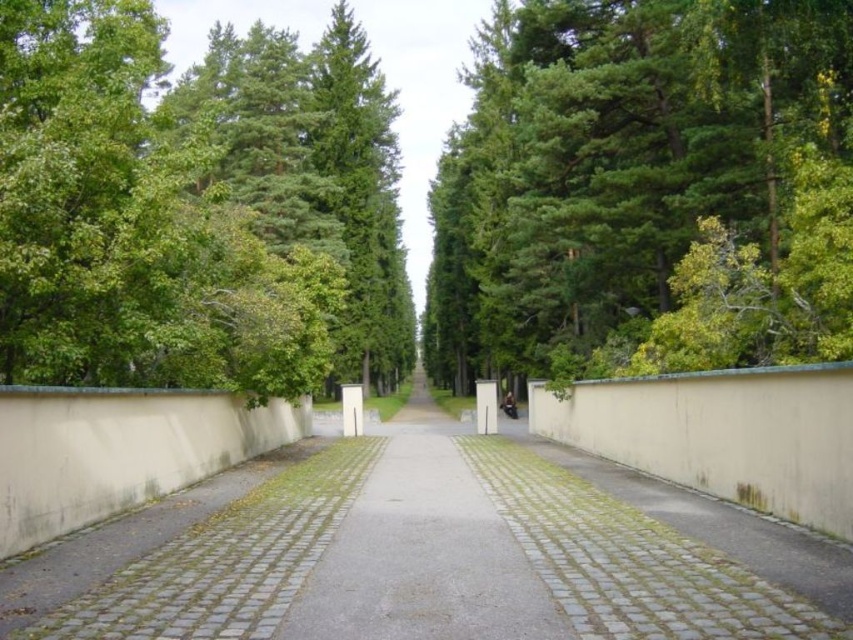
You are a gardener standing on the pathway in the image. You need to place a new decorative stone. The stone is too heavy to lift, so you must decide whether to place it on the beige concrete pavement at center or the gray cobblestone pavement at center based on their positions. Which pavement is higher and thus more accessible for placing the stone without moving it?

The beige concrete pavement at center is located above the gray cobblestone pavement at center, so the beige concrete pavement at center is higher and more accessible for placing the stone without moving it.

You are standing at the entrance of the pathway and want to walk towards the green leafy tree at center. Which direction should you walk to avoid the larger green leafy tree at left?

The green leafy tree at center is smaller than the green leafy tree at left. To avoid the larger tree on the left, walk towards the right side of the pathway.

You are a gardener standing at the entrance of the pathway. You need to prune the green leafy tree at center so that it doesn not block the sunlight to the beige concrete pavement at center. Can you do it?

The green leafy tree at center is taller than beige concrete pavement at center. Yes, you can prune the green leafy tree at center to allow sunlight to reach the beige concrete pavement at center.